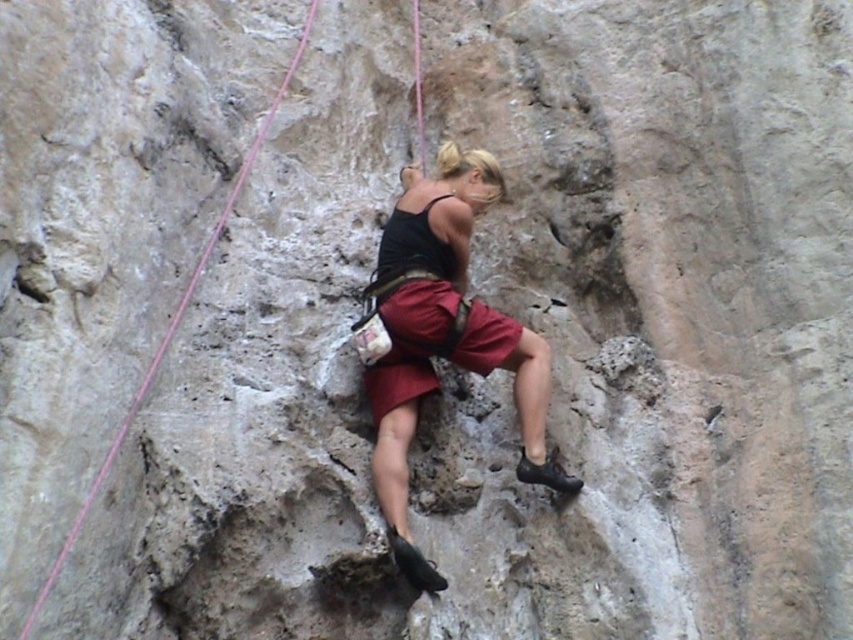
Based on the photo, who is more distant from viewer, (450,170) or (393,378)?

Positioned behind is point (450,170).

Based on the photo, measure the distance from matte black tank top at center to matte red shorts at center.

matte black tank top at center and matte red shorts at center are 28.49 inches apart.

Between point (486, 365) and point (434, 316), which one is positioned behind?

The point (434, 316) is more distant.

I want to click on matte black tank top at center, so click(x=442, y=337).